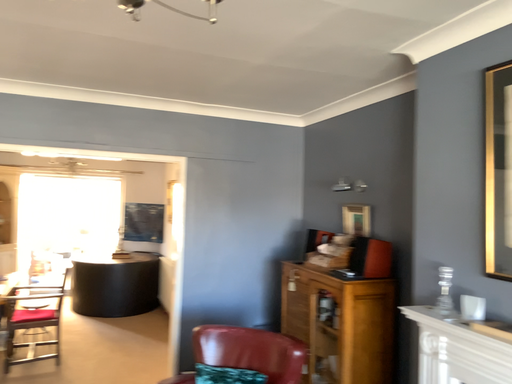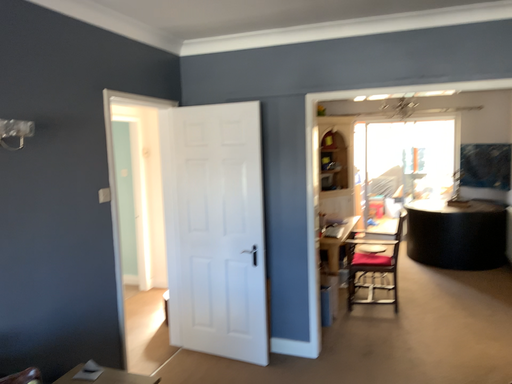
Question: How did the camera likely rotate when shooting the video?

Choices:
 (A) rotated right
 (B) rotated left

Answer: (B)